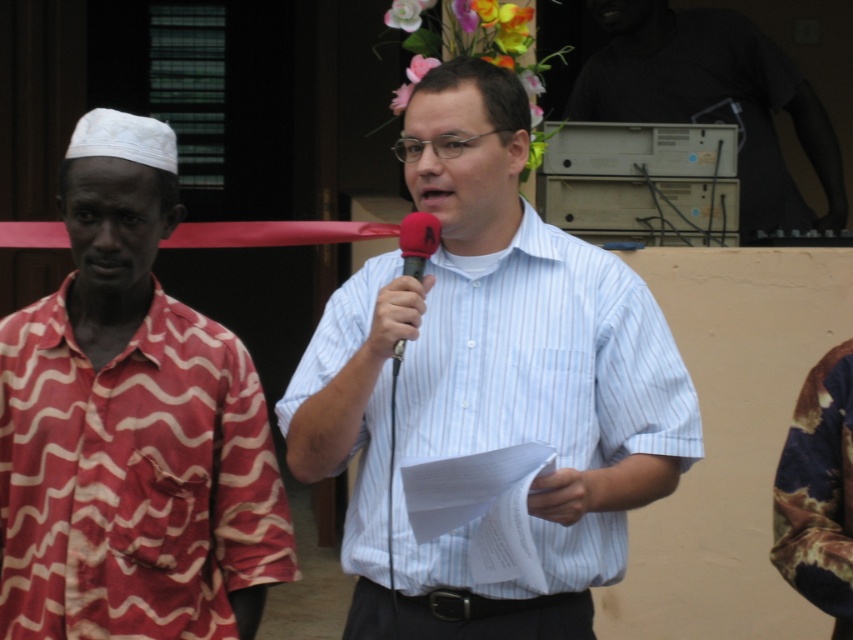
Question: Which object is positioned closest to the light blue striped shirt at center?

Choices:
 (A) red matte microphone at center
 (B) wavy fabric shirt at left

Answer: (A)

Question: Can you confirm if wavy fabric shirt at left is wider than light blue striped shirt at center?

Choices:
 (A) no
 (B) yes

Answer: (A)

Question: Considering the real-world distances, which object is closest to the red matte microphone at center?

Choices:
 (A) wavy fabric shirt at left
 (B) light blue striped shirt at center

Answer: (B)

Question: Can you confirm if light blue striped shirt at center is smaller than red matte microphone at center?

Choices:
 (A) yes
 (B) no

Answer: (B)

Question: Is wavy fabric shirt at left above red matte microphone at center?

Choices:
 (A) yes
 (B) no

Answer: (B)

Question: Which object is positioned farthest from the wavy fabric shirt at left?

Choices:
 (A) light blue striped shirt at center
 (B) red matte microphone at center

Answer: (B)